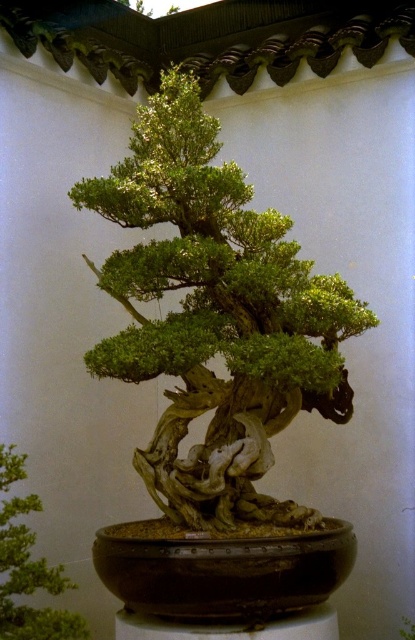
You are an interior designer planning to place a decorative item on a shelf that can only accommodate items up to 30 cm in width. You have two options from the image, the green textured bonsai at center and the green matte bonsai tree at center. Which one can you choose based on their widths?

The green textured bonsai at center is wider than the green matte bonsai tree at center. Since the shelf can only hold items up to 30 cm, you should choose the green matte bonsai tree at center to ensure it fits within the width limit.

You are an interior designer arranging plants in a room. You have two bonsai trees, the green textured bonsai at center and the green matte bonsai tree at center. Which one is placed higher up in the room?

The green textured bonsai at center is located above the green matte bonsai tree at center, so it is placed higher up in the room.